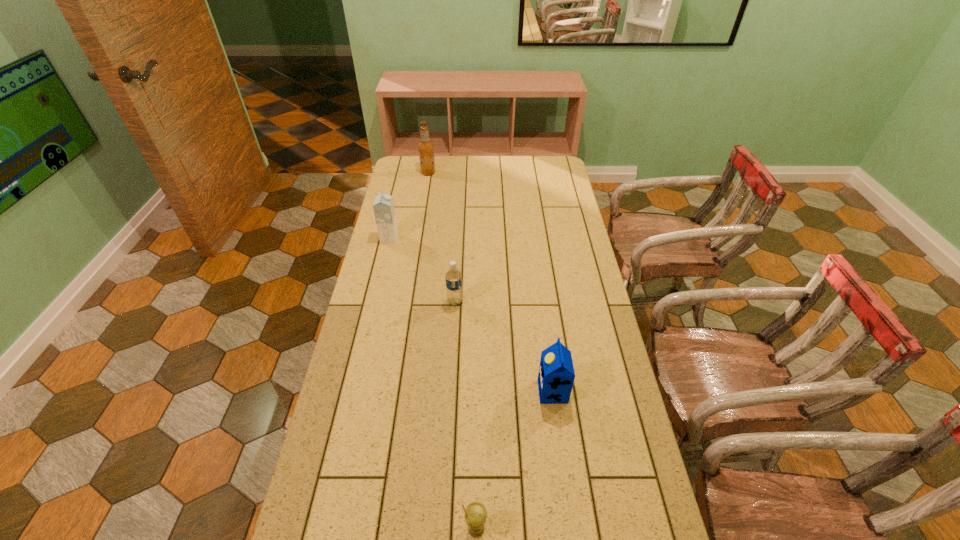
Find the location of `vacant area at the right edge of the desktop`. vacant area at the right edge of the desktop is located at coordinates (558, 259).

Identify the location of free space at the far right corner of the desktop. The image size is (960, 540). (546, 167).

I want to click on free space that is in between the third object from left to right and the right carton, so click(x=504, y=347).

Locate an element on the screen. empty space that is in between the rightmost object and the farthest object is located at coordinates (491, 282).

What are the coordinates of `free spot between the farther carton and the tallest object` in the screenshot? It's located at (409, 205).

You are a GUI agent. You are given a task and a screenshot of the screen. Output one action in this format:
    pyautogui.click(x=<x>, y=<y>)
    Task: Click on the free space between the third object from left to right and the fourth object from right to left
    Image resolution: width=960 pixels, height=540 pixels.
    Given the screenshot: What is the action you would take?
    pyautogui.click(x=442, y=237)

Locate an element on the screen. vacant space that's between the rightmost object and the second object from left to right is located at coordinates [491, 282].

Locate an element on the screen. The image size is (960, 540). free point between the nearer carton and the third object from left to right is located at coordinates (504, 347).

Identify the location of object that stands as the closest to the farther carton. (453, 276).

Where is `the second closest object to the shortest object`? This screenshot has width=960, height=540. the second closest object to the shortest object is located at coordinates (453, 276).